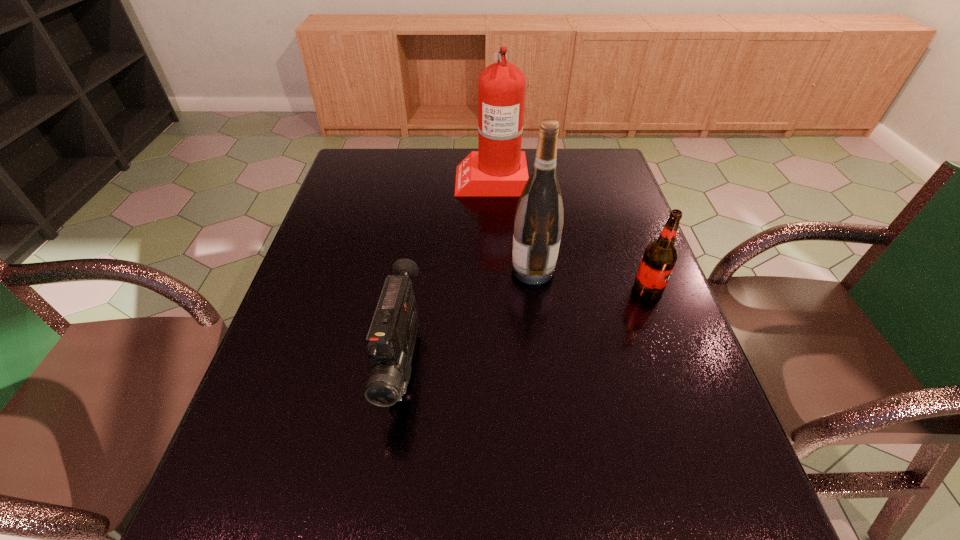
Identify the location of free space located 0.140m on the label of the wine bottle. This screenshot has width=960, height=540. (457, 270).

The width and height of the screenshot is (960, 540). Find the location of `vacant area located on the label of the wine bottle`. vacant area located on the label of the wine bottle is located at coordinates (391, 270).

The image size is (960, 540). Identify the location of free location located on the left of the root beer. (552, 289).

Locate an element on the screen. The width and height of the screenshot is (960, 540). vacant region located on the front-facing side of the leftmost object is located at coordinates (386, 473).

Where is `object present at the far edge`? object present at the far edge is located at coordinates (499, 168).

Locate an element on the screen. Image resolution: width=960 pixels, height=540 pixels. object located at the right edge is located at coordinates (659, 259).

In the image, there is a desktop. Find the location of `free region at the far edge`. free region at the far edge is located at coordinates (409, 171).

The height and width of the screenshot is (540, 960). I want to click on blank area at the near edge, so click(x=551, y=508).

Locate an element on the screen. free space at the left edge is located at coordinates (250, 446).

Find the location of a particular element. The image size is (960, 540). vacant space at the right edge is located at coordinates (x=672, y=335).